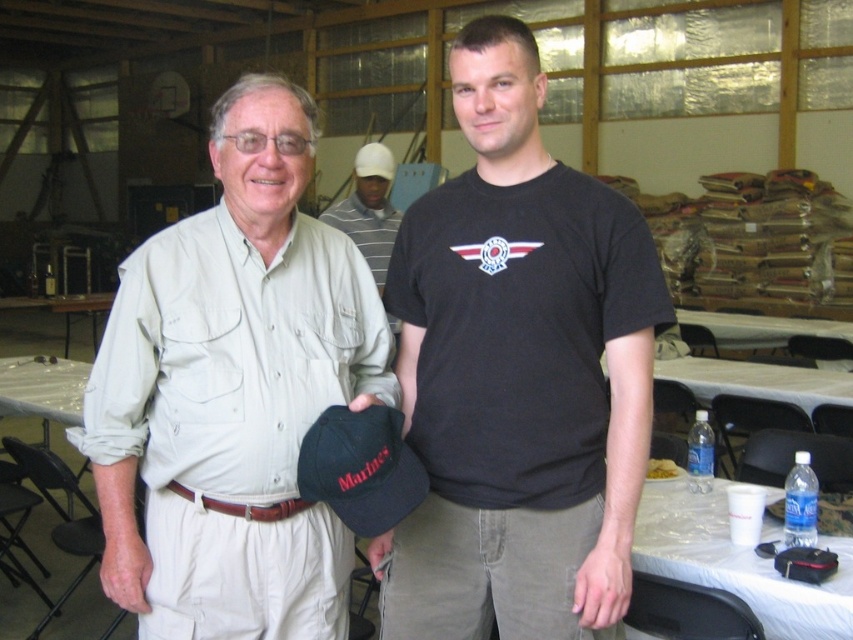
The width and height of the screenshot is (853, 640). Find the location of `light beige cotton shirt at center`. light beige cotton shirt at center is located at coordinates (233, 390).

Can you confirm if light beige cotton shirt at center is shorter than dark blue fabric baseball cap at center?

No.

This screenshot has width=853, height=640. I want to click on light beige cotton shirt at center, so click(233, 390).

Does white striped shirt at upper center have a lesser width compared to white plastic table at center?

Correct, white striped shirt at upper center's width is less than white plastic table at center's.

This screenshot has width=853, height=640. What are the coordinates of `white striped shirt at upper center` in the screenshot? It's located at (369, 209).

Can you confirm if clear plastic table at lower right is smaller than brown leather belt at center?

No, clear plastic table at lower right is not smaller than brown leather belt at center.

Is clear plastic table at lower right wider than brown leather belt at center?

Indeed, clear plastic table at lower right has a greater width compared to brown leather belt at center.

Measure the distance between point (840,620) and camera.

A distance of 1.80 meters exists between point (840,620) and camera.

You are a GUI agent. You are given a task and a screenshot of the screen. Output one action in this format:
    pyautogui.click(x=<x>, y=<y>)
    Task: Click on the clear plastic table at lower right
    
    Given the screenshot: What is the action you would take?
    tap(735, 561)